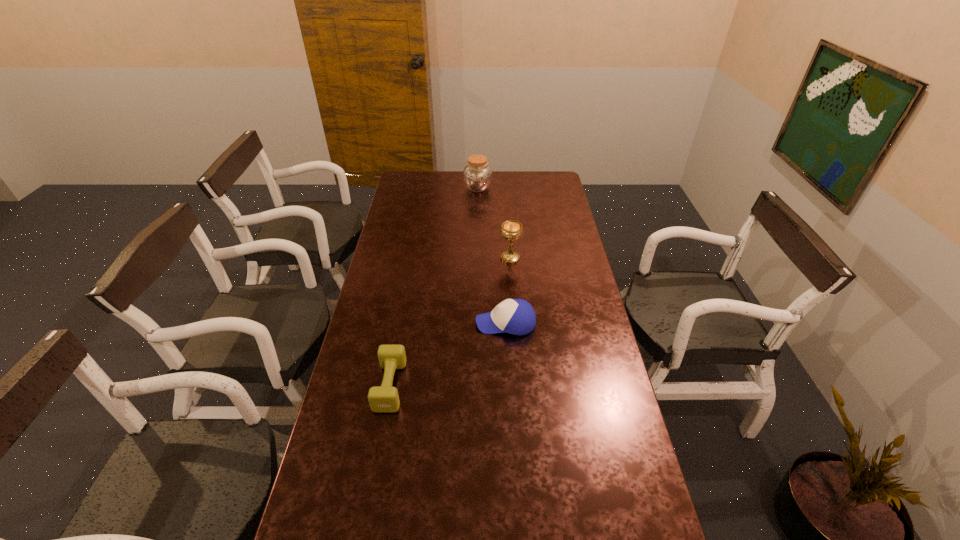
Image resolution: width=960 pixels, height=540 pixels. In order to click on the farthest object in this screenshot , I will do 477,175.

Identify the location of the second farthest object. The height and width of the screenshot is (540, 960). (511, 230).

Find the location of a particular element. This screenshot has height=540, width=960. baseball cap is located at coordinates (514, 316).

The width and height of the screenshot is (960, 540). Find the location of `the nearest object`. the nearest object is located at coordinates (382, 399).

Where is `the leftmost object`? The height and width of the screenshot is (540, 960). the leftmost object is located at coordinates (382, 399).

The width and height of the screenshot is (960, 540). Identify the location of blank area located on the right of the farthest object. (540, 188).

The height and width of the screenshot is (540, 960). What are the coordinates of `free space located 0.400m on the left of the chalice` in the screenshot? It's located at (403, 258).

At what (x,y) coordinates should I click in order to perform the action: click on free space located on the front-facing side of the baseball cap. Please return your answer as a coordinate pair (x, y). Looking at the image, I should click on (374, 323).

The width and height of the screenshot is (960, 540). I want to click on free region located on the front-facing side of the baseball cap, so click(x=392, y=323).

The width and height of the screenshot is (960, 540). What are the coordinates of `vacant space located on the front-facing side of the baseball cap` in the screenshot? It's located at (397, 323).